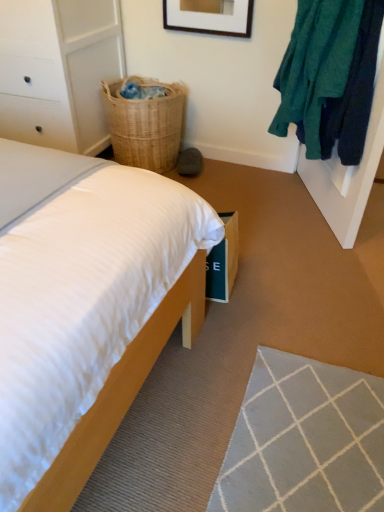
I want to click on vacant region below teal fuzzy sweater at upper right (from a real-world perspective), so click(279, 218).